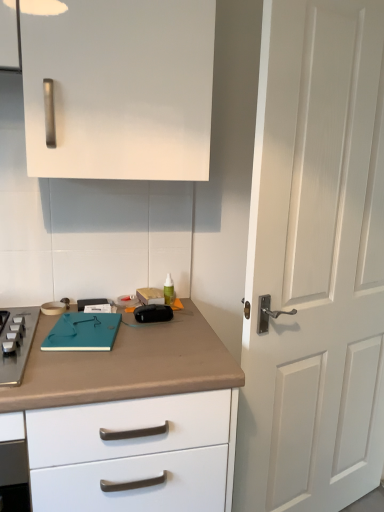
Question: From a real-world perspective, is teal matte notebook at center beneath brown matte countertop at lower left?

Choices:
 (A) no
 (B) yes

Answer: (A)

Question: Is teal matte notebook at center completely or partially outside of brown matte countertop at lower left?

Choices:
 (A) no
 (B) yes

Answer: (A)

Question: Is teal matte notebook at center oriented towards brown matte countertop at lower left?

Choices:
 (A) yes
 (B) no

Answer: (A)

Question: Is teal matte notebook at center shorter than brown matte countertop at lower left?

Choices:
 (A) no
 (B) yes

Answer: (B)

Question: Would you say brown matte countertop at lower left is part of teal matte notebook at center's contents?

Choices:
 (A) yes
 (B) no

Answer: (B)

Question: Is point (372, 260) positioned closer to the camera than point (86, 333)?

Choices:
 (A) farther
 (B) closer

Answer: (A)

Question: From the image's perspective, is white matte door at right located above or below teal matte notebook at center?

Choices:
 (A) below
 (B) above

Answer: (B)

Question: Looking at their shapes, would you say white matte door at right is wider or thinner than teal matte notebook at center?

Choices:
 (A) wide
 (B) thin

Answer: (B)

Question: Considering the positions of white matte door at right and teal matte notebook at center in the image, is white matte door at right taller or shorter than teal matte notebook at center?

Choices:
 (A) tall
 (B) short

Answer: (A)

Question: From the image's perspective, is teal matte notebook at center positioned above or below brown matte countertop at lower left?

Choices:
 (A) above
 (B) below

Answer: (A)

Question: From a real-world perspective, is teal matte notebook at center positioned above or below brown matte countertop at lower left?

Choices:
 (A) above
 (B) below

Answer: (A)

Question: In terms of width, does teal matte notebook at center look wider or thinner when compared to brown matte countertop at lower left?

Choices:
 (A) thin
 (B) wide

Answer: (A)

Question: Would you say teal matte notebook at center is to the left or to the right of brown matte countertop at lower left in the picture?

Choices:
 (A) left
 (B) right

Answer: (A)

Question: Would you say teal matte notebook at center is to the left or to the right of white matte door at right in the picture?

Choices:
 (A) right
 (B) left

Answer: (B)

Question: From a real-world perspective, is teal matte notebook at center physically located above or below white matte door at right?

Choices:
 (A) above
 (B) below

Answer: (B)